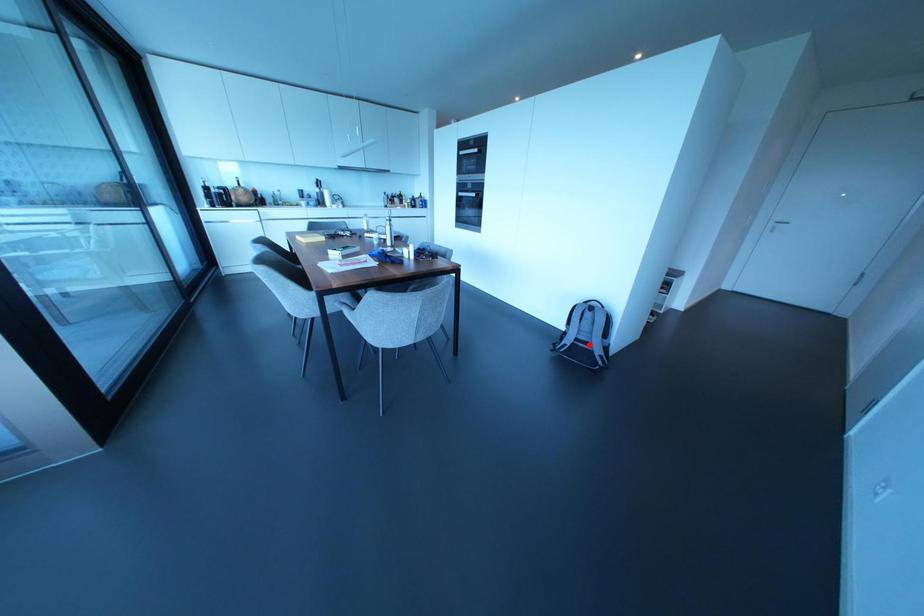
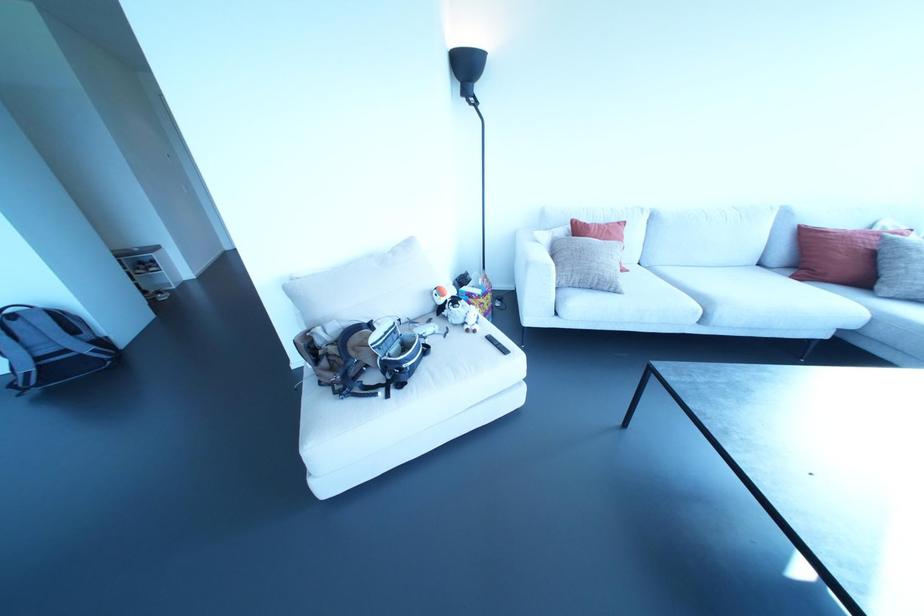
The point at the highlighted location is marked in the first image. Where is the corresponding point in the second image?

(65, 350)